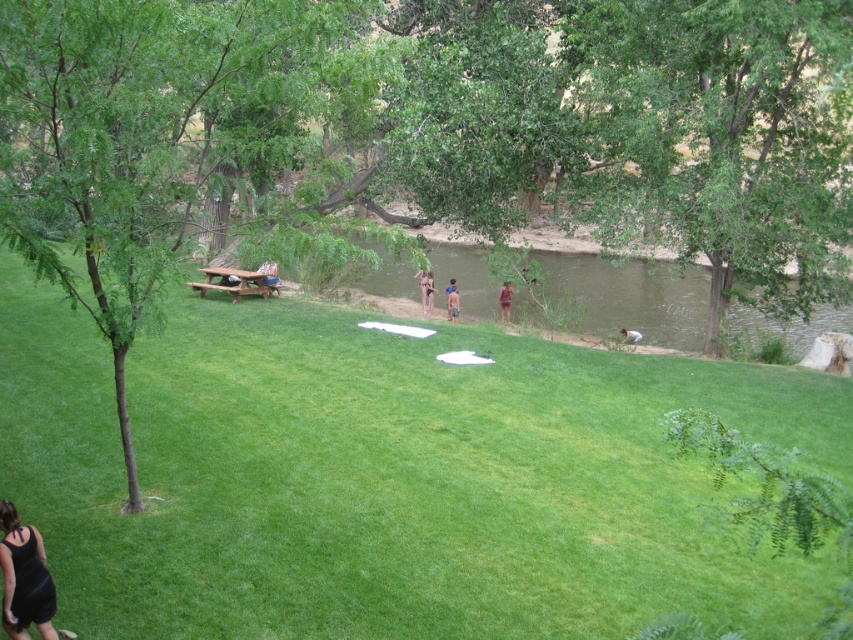
From the picture: Can you confirm if green leafy tree at center is positioned to the left of black matte dress at lower left?

Correct, you'll find green leafy tree at center to the left of black matte dress at lower left.

Can you confirm if green leafy tree at center is bigger than black matte dress at lower left?

Yes, green leafy tree at center is bigger than black matte dress at lower left.

Identify the location of green leafy tree at center. (155, 132).

Does tan skin person at center have a larger size compared to purple fabric dress at center?

Correct, tan skin person at center is larger in size than purple fabric dress at center.

What do you see at coordinates (425, 289) in the screenshot? The height and width of the screenshot is (640, 853). I see `tan skin person at center` at bounding box center [425, 289].

Locate an element on the screen. tan skin person at center is located at coordinates (425, 289).

Does wooden picnic table at center-left appear under purple fabric dress at center?

No.

Who is shorter, wooden picnic table at center-left or purple fabric dress at center?

With less height is purple fabric dress at center.

What are the coordinates of `wooden picnic table at center-left` in the screenshot? It's located at (270, 275).